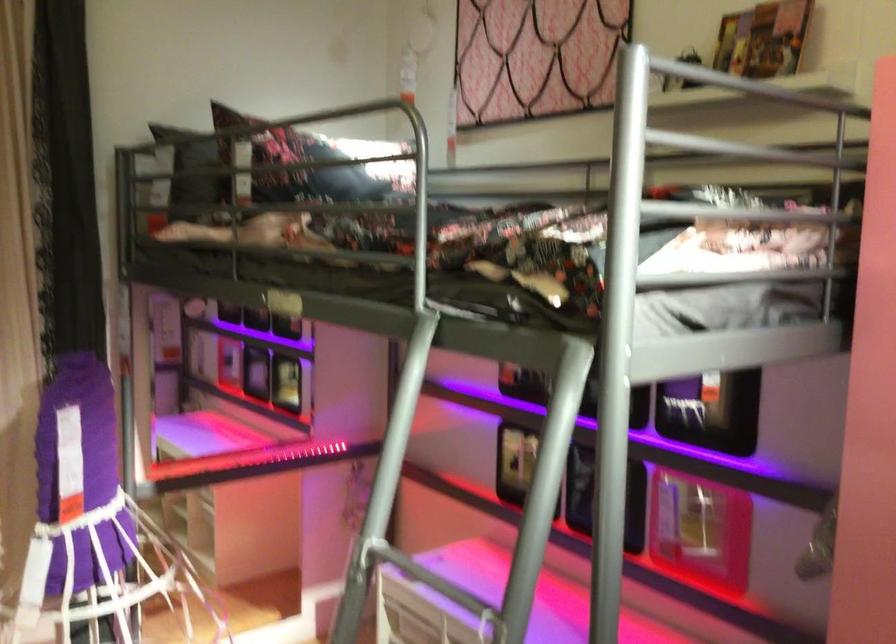
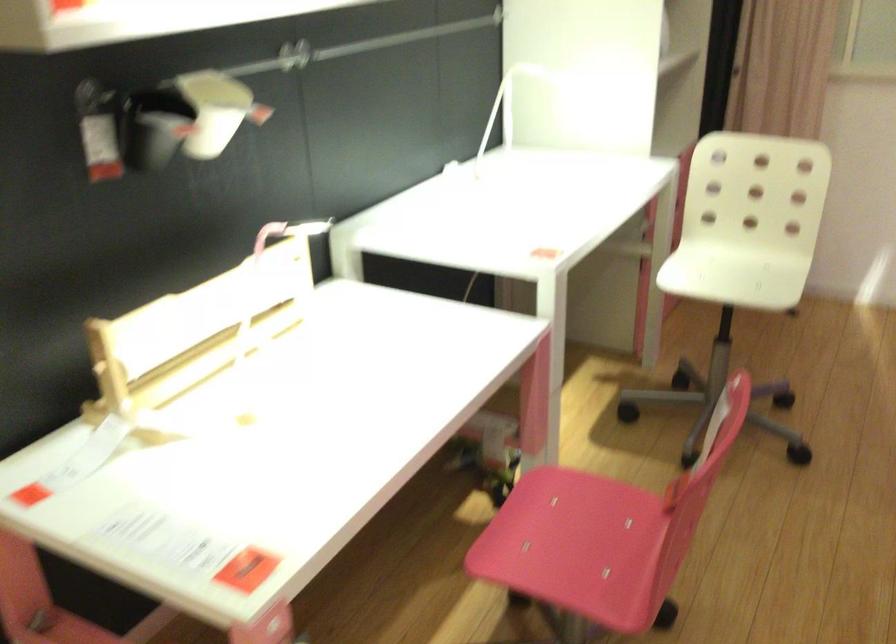
First-person continuous shooting, in which direction is the camera rotating?

The camera rotated toward left-down.